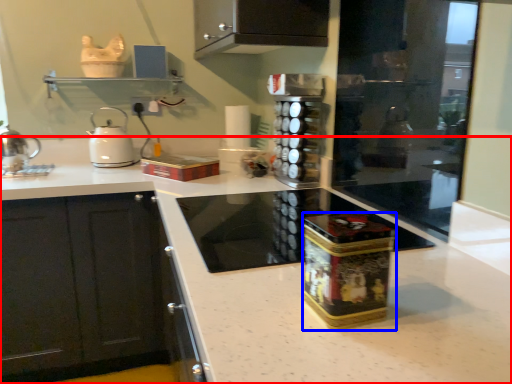
Question: Which of the following is the closest to the observer, countertop (highlighted by a red box) or appliance (highlighted by a blue box)?

Choices:
 (A) countertop
 (B) appliance

Answer: (A)